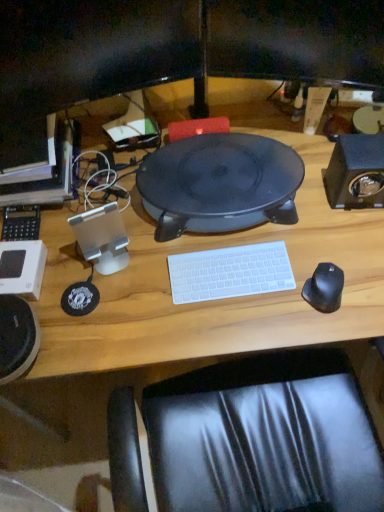
Locate an element on the screen. The width and height of the screenshot is (384, 512). vacant space in between black matte speaker at right and black matte speaker at center is located at coordinates (319, 186).